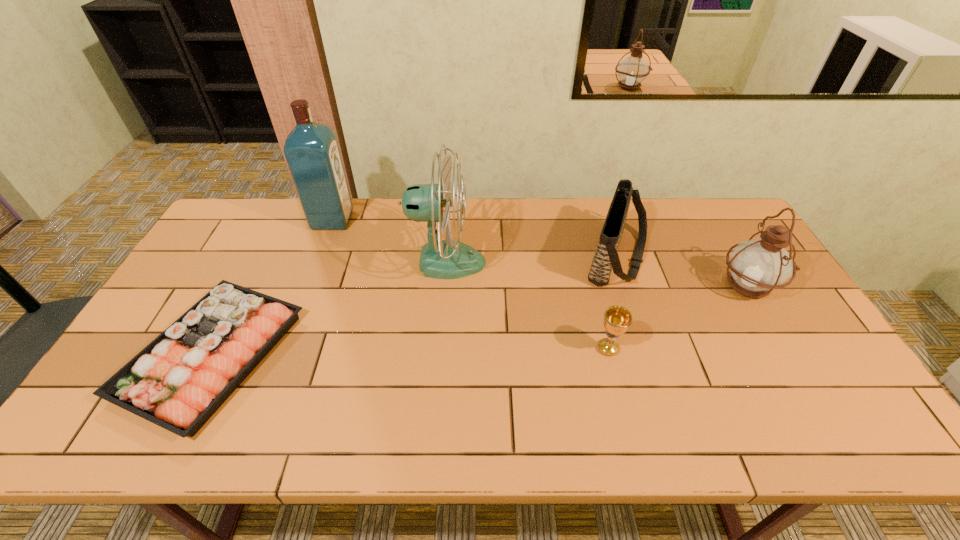
Where is `vacant space that is in between the platter and the fourth tallest object`? vacant space that is in between the platter and the fourth tallest object is located at coordinates (415, 306).

The width and height of the screenshot is (960, 540). I want to click on free space between the liquor and the platter, so click(x=273, y=287).

Locate an element on the screen. The height and width of the screenshot is (540, 960). empty space that is in between the shortest object and the fourth tallest object is located at coordinates (415, 306).

The image size is (960, 540). I want to click on free spot between the fifth tallest object and the handbag, so click(x=612, y=303).

This screenshot has width=960, height=540. Identify the location of empty space between the platter and the fifth tallest object. (410, 352).

Identify which object is the fourth closest to the fourth shortest object. Please provide its 2D coordinates. Your answer should be formatted as a tuple, i.e. [(x, y)], where the tuple contains the x and y coordinates of a point satisfying the conditions above.

[(311, 149)]

This screenshot has width=960, height=540. What are the coordinates of `object identified as the closest to the rightmost object` in the screenshot? It's located at (606, 258).

You are a GUI agent. You are given a task and a screenshot of the screen. Output one action in this format:
    pyautogui.click(x=<x>, y=<y>)
    Task: Click on the vacant space that satisfies the following two spatial constraints: 1. in front of the fan, directing airflow; 2. on the right side of the fifth tallest object
    
    Given the screenshot: What is the action you would take?
    pyautogui.click(x=440, y=348)

Locate an element on the screen. Image resolution: width=960 pixels, height=540 pixels. vacant space that satisfies the following two spatial constraints: 1. on the flat label side of the oil lamp; 2. on the left side of the liquor is located at coordinates (307, 286).

Find the location of a particular element. Image resolution: width=960 pixels, height=540 pixels. free point that satisfies the following two spatial constraints: 1. on the back side of the chalice; 2. on the left side of the platter is located at coordinates (215, 348).